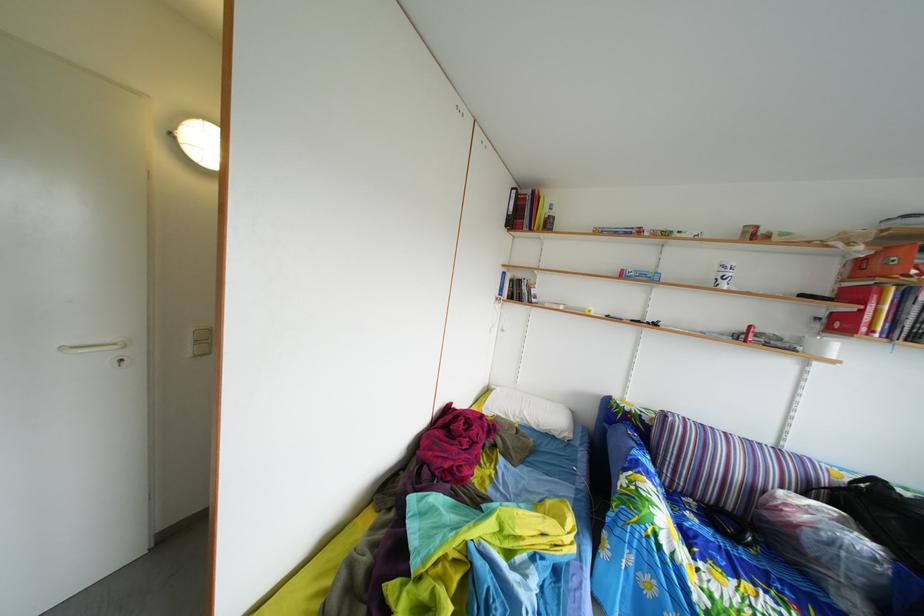
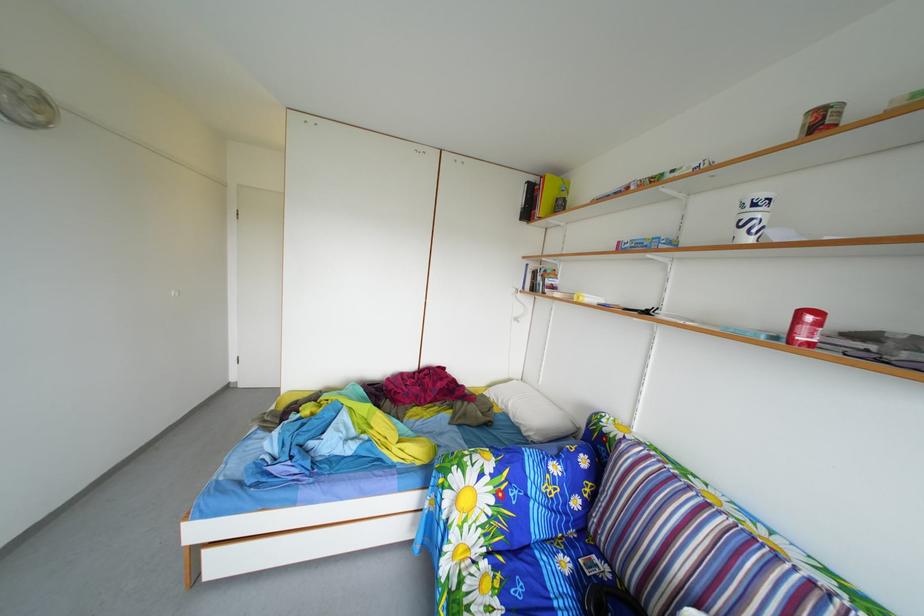
Where in the second image is the point corresponding to point (699, 524) from the first image?

(576, 570)